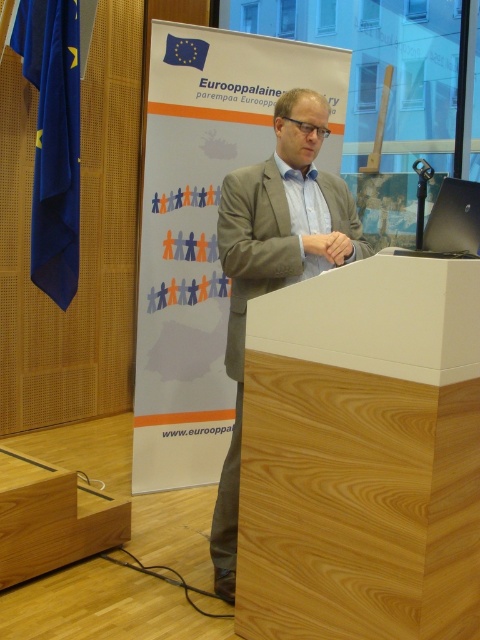
You are standing in the front row of the audience facing the stage. Where is the light brown wood podium at center located in terms of coordinates?

The light brown wood podium at center is located at coordinates point [362,456].

You are standing at the point marked as point (453, 493) and want to walk to the podium. The distance between you and the podium is 1.68 meters. If your walking speed is 0.5 meters per second, how many seconds will it take you to reach the podium?

The distance between you and the podium is 1.68 meters. At a speed of 0.5 meters per second, it will take 1.68 divided by 0.5, which equals 3.36 seconds to reach the podium.

You are an event organizer who needs to set up a microphone stand between the light brown wood podium at center and the wooden podium at lower left. The microphone stand requires a minimum of 40 inches of space between the two podiums to be placed safely. Based on the scene description, can you safely place the microphone stand between them?

The light brown wood podium at center is only 38.36 inches from the wooden podium at lower left, which is less than the required 40 inches. Therefore, the microphone stand cannot be placed safely between them.